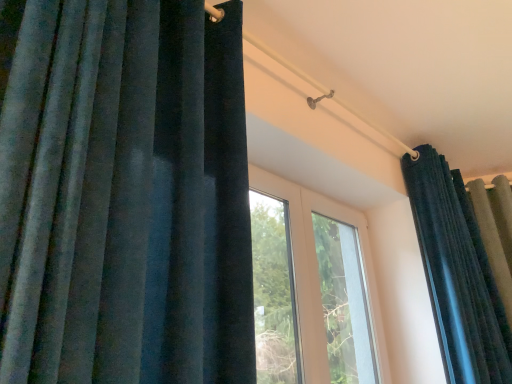
Question: Considering the relative positions of velvet dark blue curtain at upper right, positioned as the 2th curtain in left-to-right order, and velvet dark blue curtain at left, acting as the 1th curtain starting from the front, in the image provided, is velvet dark blue curtain at upper right, positioned as the 2th curtain in left-to-right order, behind velvet dark blue curtain at left, acting as the 1th curtain starting from the front,?

Choices:
 (A) yes
 (B) no

Answer: (A)

Question: From the image's perspective, is velvet dark blue curtain at upper right, which appears as the first curtain when viewed from the right, located beneath velvet dark blue curtain at left, arranged as the 2th curtain when viewed from the back?

Choices:
 (A) no
 (B) yes

Answer: (B)

Question: Does velvet dark blue curtain at upper right, which appears as the first curtain when viewed from the right, appear on the right side of velvet dark blue curtain at left, acting as the 1th curtain starting from the front?

Choices:
 (A) no
 (B) yes

Answer: (B)

Question: Is velvet dark blue curtain at upper right, which appears as the first curtain when viewed from the right, positioned in front of velvet dark blue curtain at left, arranged as the 2th curtain when viewed from the back?

Choices:
 (A) yes
 (B) no

Answer: (B)

Question: Considering the relative sizes of velvet dark blue curtain at upper right, which appears as the first curtain when viewed from the right, and velvet dark blue curtain at left, which ranks as the 1th curtain in left-to-right order, in the image provided, is velvet dark blue curtain at upper right, which appears as the first curtain when viewed from the right, bigger than velvet dark blue curtain at left, which ranks as the 1th curtain in left-to-right order,?

Choices:
 (A) yes
 (B) no

Answer: (A)

Question: Considering the positions of point tap(57, 31) and point tap(480, 254), is point tap(57, 31) closer or farther from the camera than point tap(480, 254)?

Choices:
 (A) closer
 (B) farther

Answer: (A)

Question: Looking at their shapes, would you say velvet dark blue curtain at left, acting as the 1th curtain starting from the front, is wider or thinner than velvet dark blue curtain at upper right, the first curtain positioned from the back?

Choices:
 (A) thin
 (B) wide

Answer: (A)

Question: Considering the relative positions of velvet dark blue curtain at left, acting as the 1th curtain starting from the front, and velvet dark blue curtain at upper right, which appears as the first curtain when viewed from the right, in the image provided, is velvet dark blue curtain at left, acting as the 1th curtain starting from the front, to the left or to the right of velvet dark blue curtain at upper right, which appears as the first curtain when viewed from the right,?

Choices:
 (A) left
 (B) right

Answer: (A)

Question: Is velvet dark blue curtain at left, which is counted as the second curtain, starting from the right, spatially inside velvet dark blue curtain at upper right, which appears as the second curtain when viewed from the front, or outside of it?

Choices:
 (A) outside
 (B) inside

Answer: (A)

Question: From a real-world perspective, is velvet dark blue curtain at upper right, which appears as the second curtain when viewed from the front, above or below transparent glass window at center?

Choices:
 (A) above
 (B) below

Answer: (A)

Question: Looking at their shapes, would you say velvet dark blue curtain at upper right, which appears as the second curtain when viewed from the front, is wider or thinner than transparent glass window at center?

Choices:
 (A) wide
 (B) thin

Answer: (A)

Question: From their relative heights in the image, would you say velvet dark blue curtain at upper right, the first curtain positioned from the back, is taller or shorter than transparent glass window at center?

Choices:
 (A) short
 (B) tall

Answer: (B)

Question: Looking at the image, does velvet dark blue curtain at upper right, the first curtain positioned from the back, seem bigger or smaller compared to transparent glass window at center?

Choices:
 (A) big
 (B) small

Answer: (A)

Question: In terms of size, does transparent glass window at center appear bigger or smaller than velvet dark blue curtain at upper right, positioned as the 2th curtain in left-to-right order?

Choices:
 (A) small
 (B) big

Answer: (A)

Question: Looking at their shapes, would you say transparent glass window at center is wider or thinner than velvet dark blue curtain at upper right, the first curtain positioned from the back?

Choices:
 (A) thin
 (B) wide

Answer: (A)